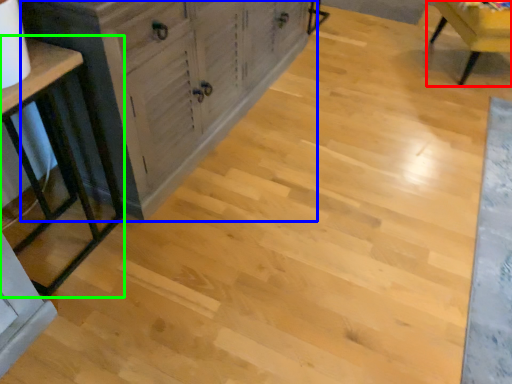
Question: Which object is the closest to the chair (highlighted by a red box)? Choose among these: cabinetry (highlighted by a blue box) or table (highlighted by a green box).

Choices:
 (A) cabinetry
 (B) table

Answer: (A)